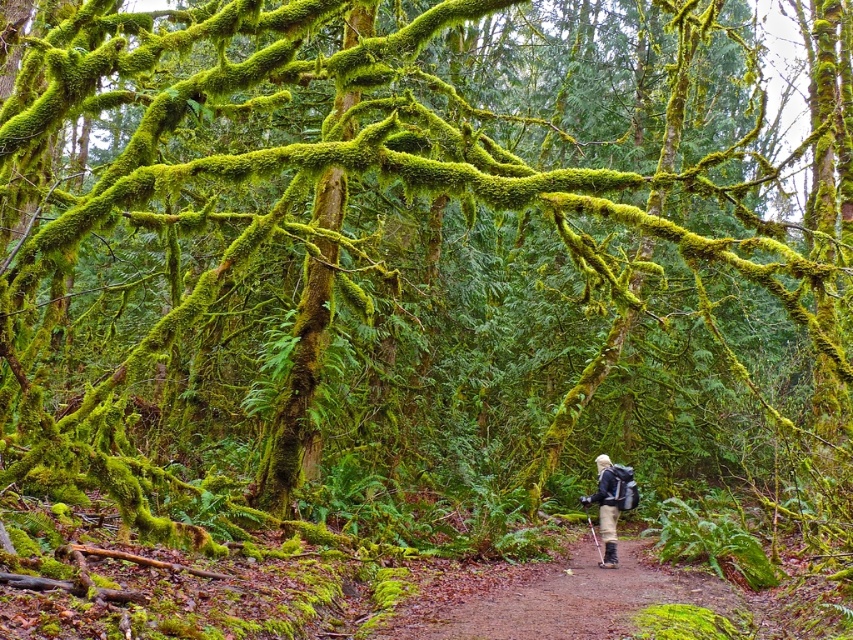
You are a hiker who wants to walk along the brown dirt path at center while carrying your matte black backpack at center. Can you walk comfortably without the backpack blocking your view of the path?

The brown dirt path at center is smaller than matte black backpack at center. This means the backpack is larger than the path, so it might block your view, making it difficult to walk comfortably.

You are a hiker who wants to place your matte black backpack at center on the ground without blocking the brown dirt path at center. Based on the scene, where should you position it?

The brown dirt path at center is on the right side of the matte black backpack at center, so to avoid blocking the path, you should place the matte black backpack at center to the left of the brown dirt path at center.

Consider the image. You are a hiker walking along the brown dirt path at center and carrying the matte black backpack at center. Which object is closer to your feet as you walk?

The brown dirt path at center is closer to your feet because it is in front of the matte black backpack at center, which is being carried on your back.